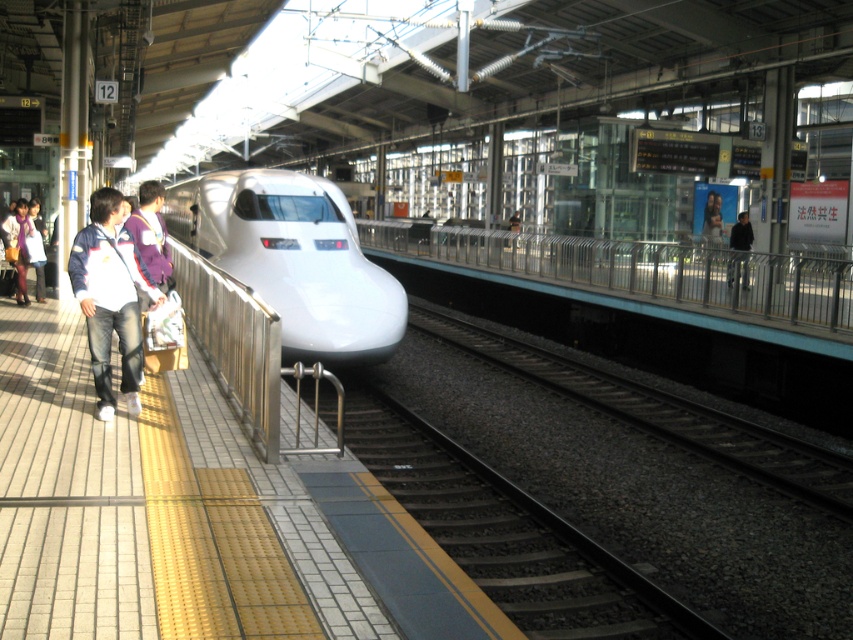
You are a passenger waiting on the platform and want to board the approaching train. You see two people wearing jackets, the matte white jacket at left and the dark blue jacket at right. Which jacket is closer to the train that is about to arrive?

The matte white jacket at left is closer to the train because it is closer to the viewer, and the train is approaching from the right side of the frame towards the left where the passenger is standing.

You are standing on the platform of the modern train station and want to know the exact position of the metallic silver rail at center. Can you tell me its coordinates?

The metallic silver rail at center is located at point (646, 278).